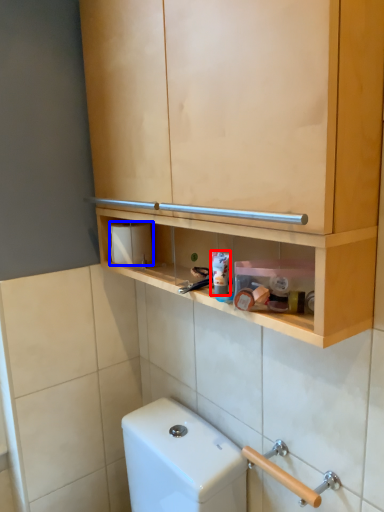
Question: Which object is further to the camera taking this photo, toothpaste (highlighted by a red box) or toilet paper (highlighted by a blue box)?

Choices:
 (A) toothpaste
 (B) toilet paper

Answer: (B)